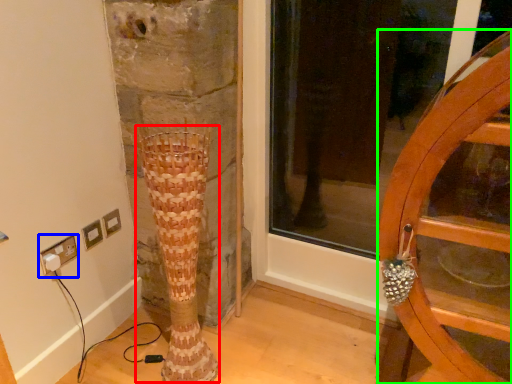
Question: Which object is the farthest from tree trunk (highlighted by a red box)? Choose among these: electric outlet (highlighted by a blue box) or furniture (highlighted by a green box).

Choices:
 (A) electric outlet
 (B) furniture

Answer: (B)